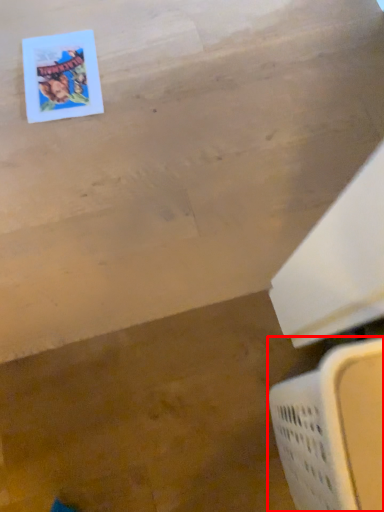
Question: From the image's perspective, where is laundry basket (annotated by the red box) located in relation to comic book in the image?

Choices:
 (A) below
 (B) above

Answer: (A)